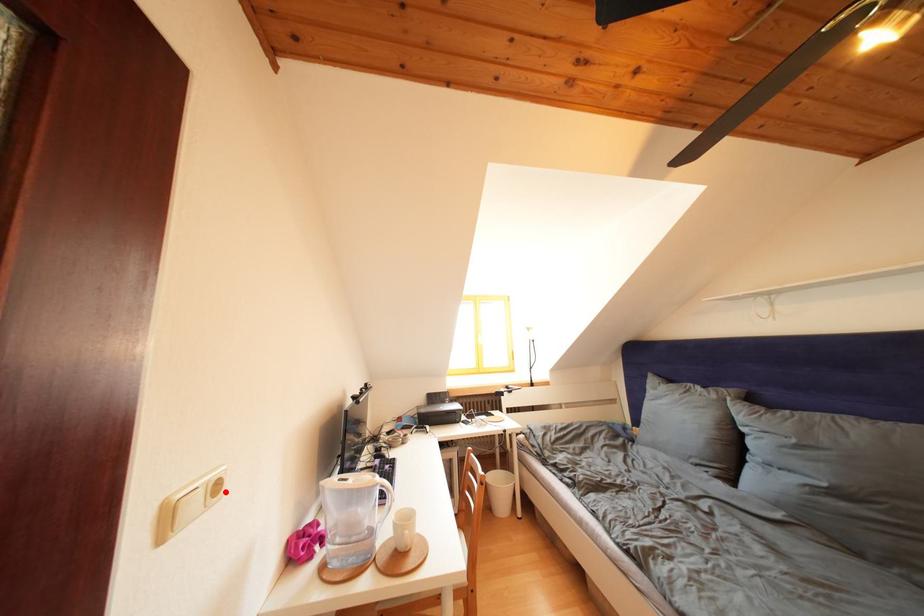
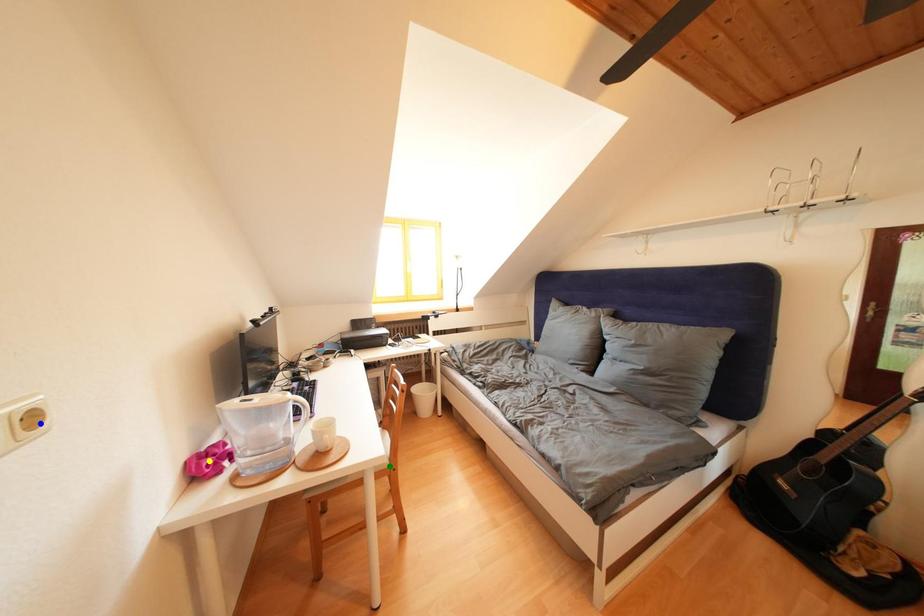
Question: I am providing you with two images of the same scene from different viewpoints. A red point is marked on the first image. You are given multiple points on the second image. Which point in image 2 represents the same 3d spot as the red point in image 1?

Choices:
 (A) blue point
 (B) green point
 (C) yellow point

Answer: (A)